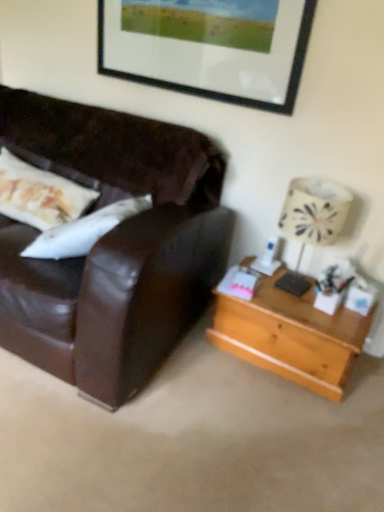
The width and height of the screenshot is (384, 512). Find the location of `light brown wooden table at right`. light brown wooden table at right is located at coordinates (292, 336).

Measure the distance between point (x=281, y=317) and camera.

1.76 meters.

Where is `white fabric lampshade at right`? white fabric lampshade at right is located at coordinates (312, 217).

Where is `light brown wooden table at right`? light brown wooden table at right is located at coordinates (292, 336).

Is light brown wooden table at right to the right of black matte picture frame at upper center from the viewer's perspective?

Yes, light brown wooden table at right is to the right of black matte picture frame at upper center.

This screenshot has width=384, height=512. In order to click on picture frame behind the light brown wooden table at right in this screenshot , I will do `click(209, 47)`.

Which is in front, point (293, 323) or point (194, 42)?

The point (293, 323) is more forward.

Which of these two, light brown wooden table at right or black matte picture frame at upper center, is thinner?

Thinner between the two is black matte picture frame at upper center.

Is point (342, 218) closer or farther from the camera than point (226, 316)?

Clearly, point (342, 218) is closer to the camera than point (226, 316).

From a real-world perspective, is white fabric lampshade at right under light brown wooden table at right?

No, from a real-world perspective, white fabric lampshade at right is not beneath light brown wooden table at right.

Between white fabric lampshade at right and light brown wooden table at right, which one is positioned behind?

light brown wooden table at right is more distant.

Are white fabric lampshade at right and light brown wooden table at right located far from each other?

That's not correct — white fabric lampshade at right is a little close to light brown wooden table at right.

Considering the relative sizes of light brown wooden table at right and white fabric lampshade at right in the image provided, is light brown wooden table at right wider than white fabric lampshade at right?

Yes.

Is light brown wooden table at right facing towards white fabric lampshade at right?

No.

Considering the positions of objects light brown wooden table at right and white fabric lampshade at right in the image provided, who is in front, light brown wooden table at right or white fabric lampshade at right?

white fabric lampshade at right.

Considering the sizes of objects light brown wooden table at right and white fabric lampshade at right in the image provided, who is bigger, light brown wooden table at right or white fabric lampshade at right?

light brown wooden table at right.

Is light brown wooden table at right located within black matte picture frame at upper center?

That's incorrect, light brown wooden table at right is not inside black matte picture frame at upper center.

Relative to light brown wooden table at right, is black matte picture frame at upper center in front or behind?

In the image, black matte picture frame at upper center appears behind light brown wooden table at right.

Is white fabric lampshade at right not near black matte picture frame at upper center?

white fabric lampshade at right is actually quite close to black matte picture frame at upper center.

Which of these two, white fabric lampshade at right or black matte picture frame at upper center, stands shorter?

Standing shorter between the two is black matte picture frame at upper center.

Based on their sizes in the image, would you say white fabric lampshade at right is bigger or smaller than black matte picture frame at upper center?

Considering their sizes, white fabric lampshade at right takes up more space than black matte picture frame at upper center.

Is point (278, 13) closer to camera compared to point (296, 216)?

No, it is not.

Can you confirm if black matte picture frame at upper center is wider than white fabric lampshade at right?

In fact, black matte picture frame at upper center might be narrower than white fabric lampshade at right.

Which of these two, black matte picture frame at upper center or white fabric lampshade at right, is smaller?

black matte picture frame at upper center is smaller.

Is black matte picture frame at upper center not near white fabric lampshade at right?

They are positioned close to each other.

At what (x,y) coordinates should I click in order to perform the action: click on picture frame above the light brown wooden table at right (from the image's perspective). Please return your answer as a coordinate pair (x, y). Looking at the image, I should click on (209, 47).

Locate an element on the screen. The height and width of the screenshot is (512, 384). table below the white fabric lampshade at right (from a real-world perspective) is located at coordinates (292, 336).

When comparing their distances from black matte picture frame at upper center, does white fabric lampshade at right or light brown wooden table at right seem closer?

white fabric lampshade at right is closer to black matte picture frame at upper center.

When comparing their distances from white fabric lampshade at right, does light brown wooden table at right or black matte picture frame at upper center seem closer?

The object closer to white fabric lampshade at right is light brown wooden table at right.

Based on their spatial positions, is black matte picture frame at upper center or white fabric lampshade at right further from light brown wooden table at right?

The object further to light brown wooden table at right is black matte picture frame at upper center.

Based on their spatial positions, is black matte picture frame at upper center or light brown wooden table at right further from white fabric lampshade at right?

Based on the image, black matte picture frame at upper center appears to be further to white fabric lampshade at right.

Looking at the image, which one is located further to black matte picture frame at upper center, light brown wooden table at right or white fabric lampshade at right?

Among the two, light brown wooden table at right is located further to black matte picture frame at upper center.

Estimate the real-world distances between objects in this image. Which object is further from light brown wooden table at right, white fabric lampshade at right or black matte picture frame at upper center?

Based on the image, black matte picture frame at upper center appears to be further to light brown wooden table at right.

Image resolution: width=384 pixels, height=512 pixels. In order to click on lamp between black matte picture frame at upper center and light brown wooden table at right vertically in this screenshot , I will do `click(312, 217)`.